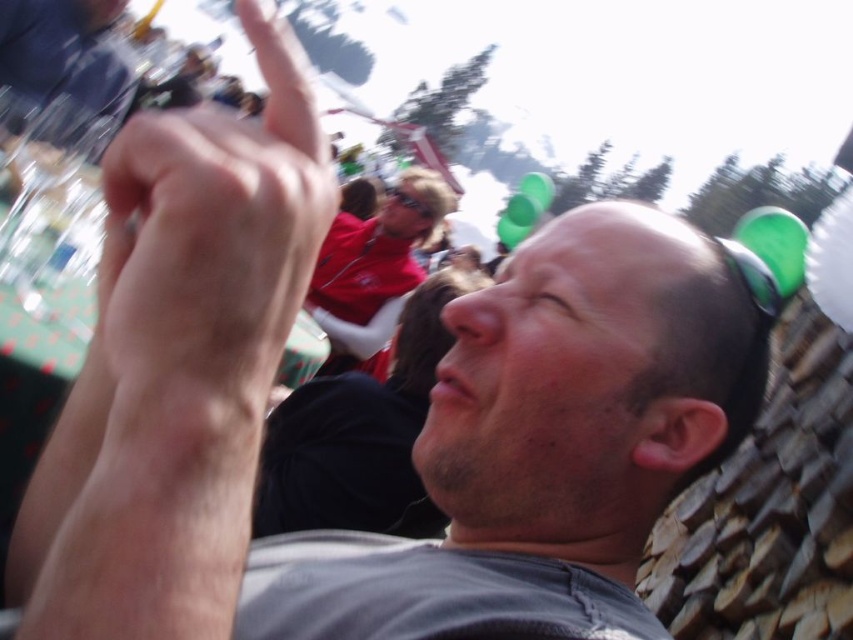
You are a photographer at the event and want to capture a closeup of the matte red shirt at center without the skinny flesh at upper left overlapping it. Is this possible given their sizes?

The skinny flesh at upper left is larger in size than the matte red shirt at center, so it might block the view of the matte red shirt at center. Adjust your angle to avoid overlap.

You are a photographer trying to capture a candid shot of the matte red shirt at center and the skinny flesh at upper left. You want to ensure both subjects are in focus. Your camera has a depth of field that can cover 3 meters. Will you be able to capture both subjects clearly in the same shot?

The skinny flesh at upper left and matte red shirt at center are 3.57 meters apart from each other. Since the depth of field can only cover 3 meters, the distance between them exceeds this range. Therefore, it will be challenging to keep both subjects in focus simultaneously in the same shot.